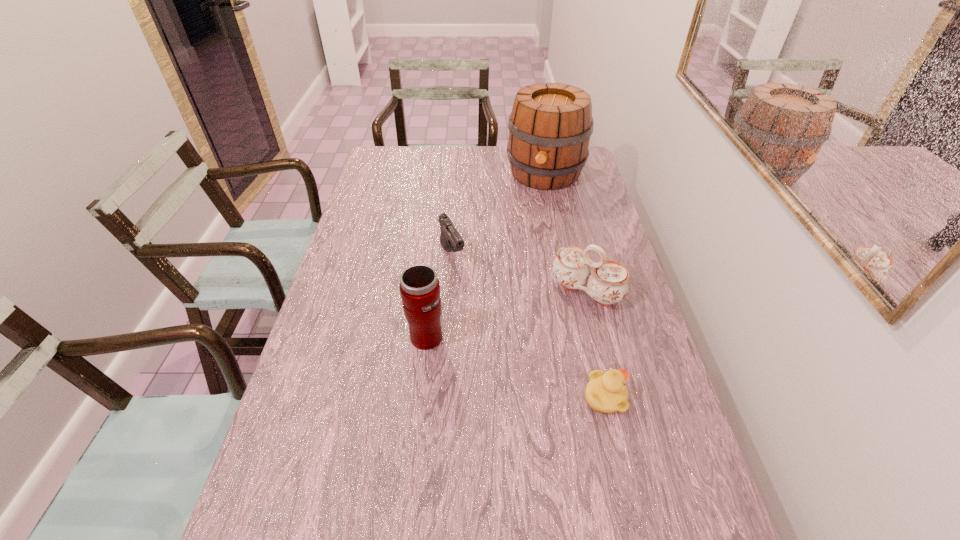
Find the location of a particular element. free space on the desktop that is between the second tallest object and the nearest object and is positioned at the barrel of the pistol is located at coordinates (517, 368).

You are a GUI agent. You are given a task and a screenshot of the screen. Output one action in this format:
    pyautogui.click(x=<x>, y=<y>)
    Task: Click on the vacant space on the desktop that is between the second tallest object and the duckling and is positioned by the handle of the chinaware
    The image size is (960, 540).
    Given the screenshot: What is the action you would take?
    pyautogui.click(x=529, y=372)

You are a GUI agent. You are given a task and a screenshot of the screen. Output one action in this format:
    pyautogui.click(x=<x>, y=<y>)
    Task: Click on the free space on the desktop that is between the thermos bottle and the nearest object and is positioned on the side of the tallest object where the spigot is located
    
    Given the screenshot: What is the action you would take?
    pyautogui.click(x=488, y=357)